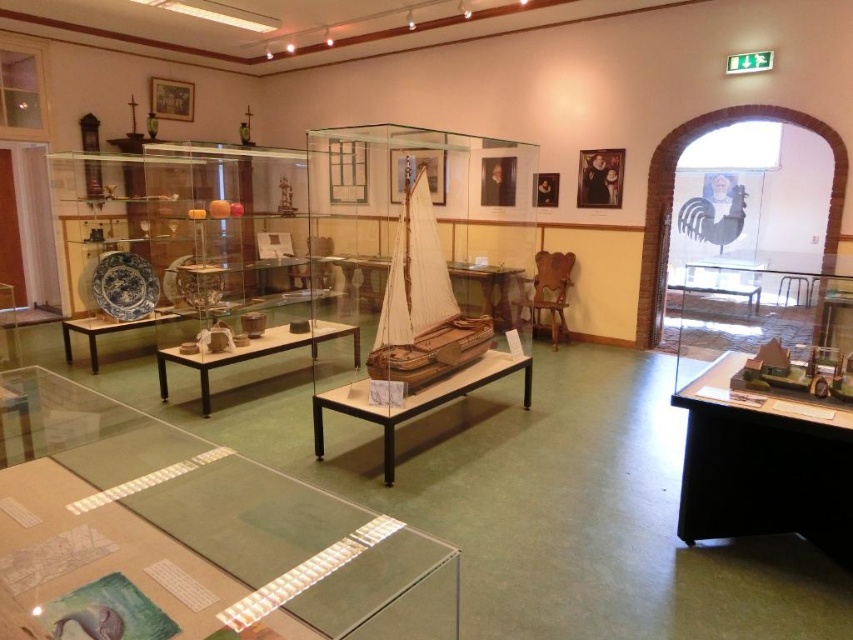
You are a visitor in the museum and want to place a small souvenir on the black plastic table at lower right. However, you notice the wooden sailboat at center is taller than the table. Will the souvenir be visible over the edge of the table?

The black plastic table at lower right is shorter than the wooden sailboat at center, so if the souvenir is placed on the table, it might be partially or fully obscured by the taller wooden sailboat at center depending on its height. To ensure visibility, choose a taller table or position the souvenir higher.

You are a visitor in the museum and want to place a small souvenir on the nearest table. You see the black plastic table at lower right and the wooden sailboat at center. Which table is closer to you?

The wooden sailboat at center is farther away than the black plastic table at lower right, so the black plastic table at lower right is closer to you.

You are a tour guide leading a group through the museum. You want to move from the wooden sailboat at center to the black plastic table at lower right to show an artifact. Can you walk directly between them without needing to go around any obstacles?

The distance between the wooden sailboat at center and the black plastic table at lower right is 1.67 meters. Since this distance is sufficient for a person to walk through, you can move directly between them without needing to go around any obstacles.